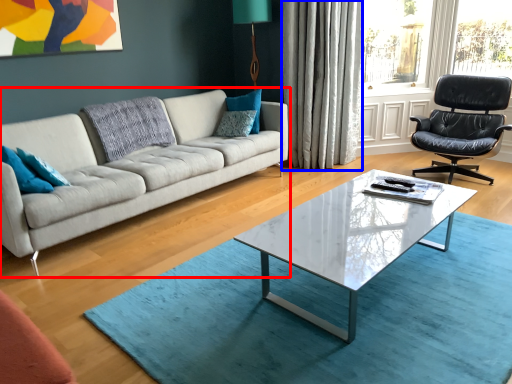
Question: Which object appears farthest to the camera in this image, studio couch (highlighted by a red box) or curtain (highlighted by a blue box)?

Choices:
 (A) studio couch
 (B) curtain

Answer: (B)